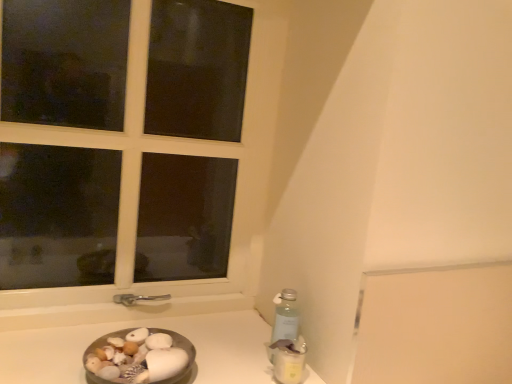
You are a GUI agent. You are given a task and a screenshot of the screen. Output one action in this format:
    pyautogui.click(x=<x>, y=<y>)
    Task: Click on the free region on the left part of translucent plastic bottle at lower right
    This screenshot has height=384, width=512.
    Given the screenshot: What is the action you would take?
    pyautogui.click(x=229, y=366)